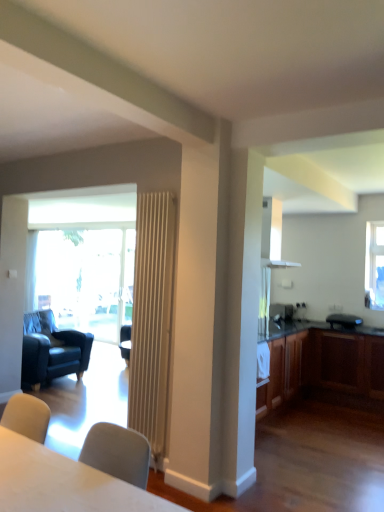
Identify the location of dark blue leather armchair at left. Image resolution: width=384 pixels, height=512 pixels. (52, 350).

Where is `white matte table at lower left`? The width and height of the screenshot is (384, 512). white matte table at lower left is located at coordinates (x=63, y=483).

Where is `wooden radiator at center`? The height and width of the screenshot is (512, 384). wooden radiator at center is located at coordinates (152, 317).

This screenshot has height=512, width=384. Identify the location of satin silver microwave at right. (281, 312).

Which is correct: clear glass window at upper right is inside wooden cabinet at right, or outside of it?

clear glass window at upper right lies outside wooden cabinet at right.

Considering the relative positions of clear glass window at upper right and wooden cabinet at right in the image provided, is clear glass window at upper right to the left or to the right of wooden cabinet at right?

clear glass window at upper right is positioned on wooden cabinet at right's right side.

Can you tell me how much clear glass window at upper right and wooden cabinet at right differ in facing direction?

The facing directions of clear glass window at upper right and wooden cabinet at right are 0.954 degrees apart.

Is point (381, 281) farther from camera compared to point (54, 359)?

That is True.

Which is more to the right, clear glass window at upper right or dark blue leather armchair at left?

From the viewer's perspective, clear glass window at upper right appears more on the right side.

Can you confirm if clear glass window at upper right is wider than dark blue leather armchair at left?

No.

Considering the sizes of objects clear glass window at upper right and dark blue leather armchair at left in the image provided, who is smaller, clear glass window at upper right or dark blue leather armchair at left?

clear glass window at upper right.

Is the position of dark blue leather armchair at left less distant than that of wooden cabinet at right?

That is False.

Which of these two, dark blue leather armchair at left or wooden cabinet at right, is bigger?

wooden cabinet at right.

In terms of width, does dark blue leather armchair at left look wider or thinner when compared to wooden cabinet at right?

Considering their sizes, dark blue leather armchair at left looks broader than wooden cabinet at right.

From the image's perspective, which one is positioned higher, satin silver microwave at right or white matte table at lower left?

satin silver microwave at right.

Based on the photo, can you tell me how much satin silver microwave at right and white matte table at lower left differ in facing direction?

There is a 89.7-degree angle between the facing directions of satin silver microwave at right and white matte table at lower left.

Is satin silver microwave at right oriented away from white matte table at lower left?

That's not correct — satin silver microwave at right is not looking away from white matte table at lower left.

Considering the sizes of objects satin silver microwave at right and white matte table at lower left in the image provided, who is wider, satin silver microwave at right or white matte table at lower left?

white matte table at lower left is wider.

Is white matte table at lower left taller or shorter than wooden cabinet at right?

Considering their sizes, white matte table at lower left has less height than wooden cabinet at right.

From a real-world perspective, is white matte table at lower left physically located above or below wooden cabinet at right?

Clearly, from a real-world perspective, white matte table at lower left is above wooden cabinet at right.

From the image's perspective, which is below, white matte table at lower left or wooden cabinet at right?

wooden cabinet at right.

The height and width of the screenshot is (512, 384). Find the location of `cabinetry on the right side of white matte table at lower left`. cabinetry on the right side of white matte table at lower left is located at coordinates (x=322, y=365).

From a real-world perspective, who is located lower, satin silver microwave at right or clear glass window at upper right?

satin silver microwave at right.

Locate an element on the screen. This screenshot has width=384, height=512. window that appears on the right of satin silver microwave at right is located at coordinates (374, 266).

Can you tell me how much satin silver microwave at right and clear glass window at upper right differ in facing direction?

There is a 88.9-degree angle between the facing directions of satin silver microwave at right and clear glass window at upper right.

Between satin silver microwave at right and clear glass window at upper right, which one appears on the right side from the viewer's perspective?

clear glass window at upper right is more to the right.

Is wooden radiator at center taller than clear glass window at upper right?

Answer: Correct, wooden radiator at center is much taller as clear glass window at upper right.

This screenshot has width=384, height=512. Find the location of `window on the right of wooden radiator at center`. window on the right of wooden radiator at center is located at coordinates pos(374,266).

Considering the points (157, 291) and (371, 275), which point is in front, point (157, 291) or point (371, 275)?

The point (157, 291) is in front.

From a real-world perspective, which object stands above the other?

clear glass window at upper right.

Identify the location of cabinetry beneath the clear glass window at upper right (from a real-world perspective). (322, 365).

Locate an element on the screen. chair located below the clear glass window at upper right (from the image's perspective) is located at coordinates (52, 350).

From the image, which object appears to be farther from satin silver microwave at right, clear glass window at upper right or wooden radiator at center?

wooden radiator at center lies further to satin silver microwave at right than the other object.

From the image, which object appears to be farther from dark blue leather armchair at left, satin silver microwave at right or clear glass window at upper right?

The object further to dark blue leather armchair at left is clear glass window at upper right.

Considering their positions, is wooden cabinet at right positioned closer to clear glass window at upper right than dark blue leather armchair at left?

wooden cabinet at right is closer to clear glass window at upper right.

Looking at this image, which object lies nearer to the anchor point white matte table at lower left, clear glass window at upper right or satin silver microwave at right?

satin silver microwave at right is closer to white matte table at lower left.

From the picture: When comparing their distances from satin silver microwave at right, does wooden radiator at center or dark blue leather armchair at left seem further?

wooden radiator at center is further to satin silver microwave at right.

Estimate the real-world distances between objects in this image. Which object is closer to white matte table at lower left, wooden cabinet at right or clear glass window at upper right?

wooden cabinet at right is closer to white matte table at lower left.

Based on their spatial positions, is clear glass window at upper right or white matte table at lower left closer to dark blue leather armchair at left?

Based on the image, white matte table at lower left appears to be nearer to dark blue leather armchair at left.

Based on their spatial positions, is clear glass window at upper right or white matte table at lower left closer to satin silver microwave at right?

clear glass window at upper right.

At what (x,y) coordinates should I click in order to perform the action: click on cabinetry positioned between wooden radiator at center and satin silver microwave at right from near to far. Please return your answer as a coordinate pair (x, y). Looking at the image, I should click on (322, 365).

You are a GUI agent. You are given a task and a screenshot of the screen. Output one action in this format:
    pyautogui.click(x=<x>, y=<y>)
    Task: Click on the radiator between white matte table at lower left and dark blue leather armchair at left along the z-axis
    The width and height of the screenshot is (384, 512).
    Given the screenshot: What is the action you would take?
    pyautogui.click(x=152, y=317)

The height and width of the screenshot is (512, 384). In order to click on appliance between dark blue leather armchair at left and wooden cabinet at right from left to right in this screenshot , I will do [x=281, y=312].

The image size is (384, 512). I want to click on radiator between white matte table at lower left and wooden cabinet at right along the z-axis, so click(x=152, y=317).